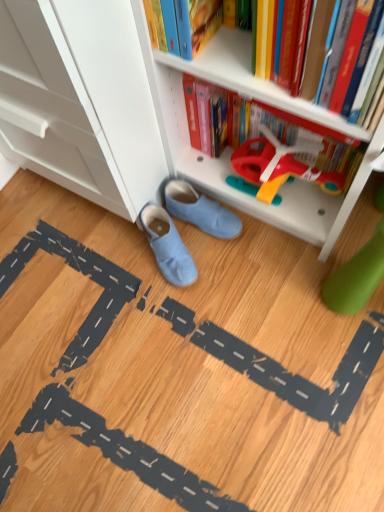
Identify the location of vacant space situated on the left part of suede-like blue slippers at center, the 2th footwear in the bottom-to-top sequence. (123, 256).